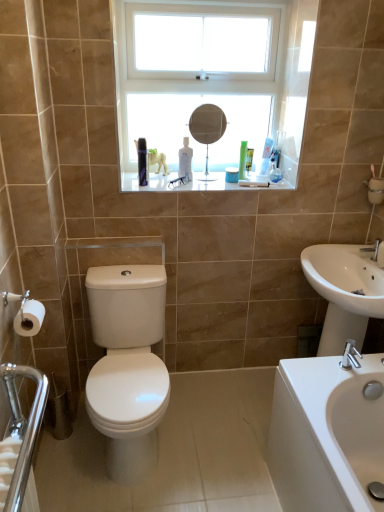
Question: Considering the positions of white glass window at upper center and matte silver mirror at center in the image, is white glass window at upper center taller or shorter than matte silver mirror at center?

Choices:
 (A) short
 (B) tall

Answer: (B)

Question: Does point (210, 177) appear closer or farther from the camera than point (205, 174)?

Choices:
 (A) farther
 (B) closer

Answer: (A)

Question: Estimate the real-world distances between objects in this image. Which object is closer to the white glossy sink at lower right, which is the 2th sink in top-to-bottom order?

Choices:
 (A) silver metallic faucet at right
 (B) translucent plastic toothbrush at upper center, which ranks as the first toiletry in top-to-bottom order
 (C) white glass window at upper center
 (D) white matte toilet paper at lower left
 (E) white glossy sink at right, the second sink in the bottom-to-top sequence

Answer: (E)

Question: Which object is positioned farthest from the silver metallic faucet at right?

Choices:
 (A) polished chrome grab bar at lower left
 (B) white glossy sink at right, the second sink in the bottom-to-top sequence
 (C) matte silver mirror at center
 (D) green matte bottle at upper center, placed as the first toiletry when sorted from left to right
 (E) white matte toilet paper at lower left

Answer: (A)